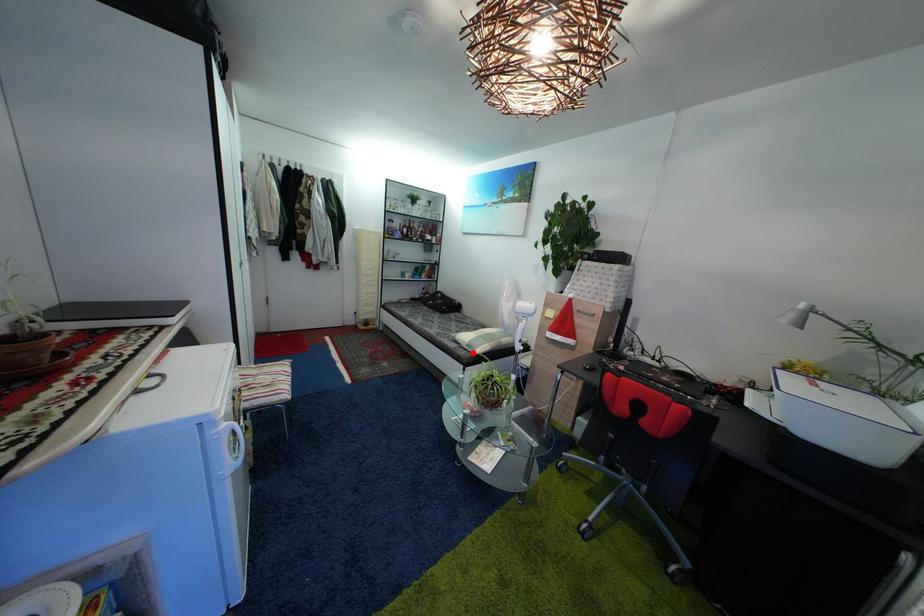
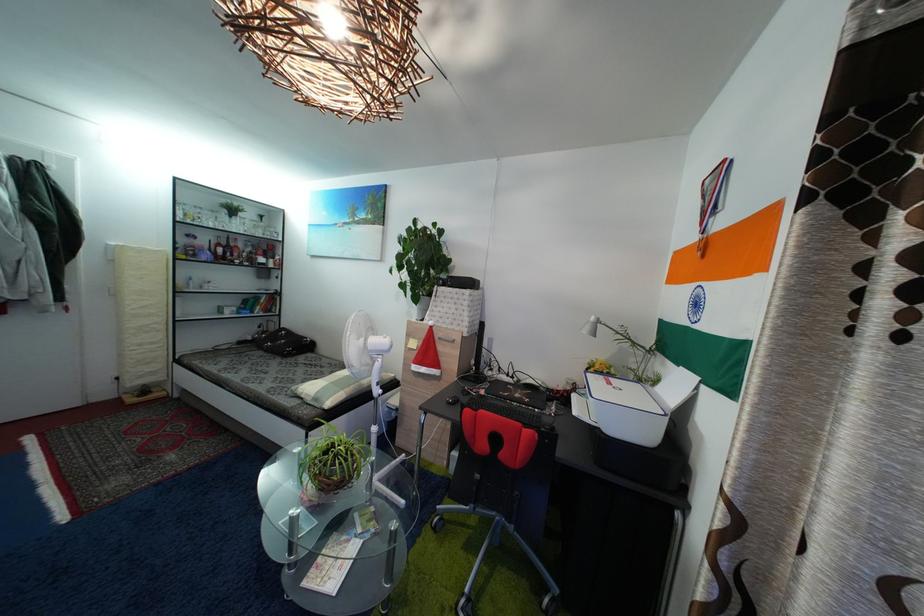
The point at the highlighted location is marked in the first image. Where is the corresponding point in the second image?

(318, 407)